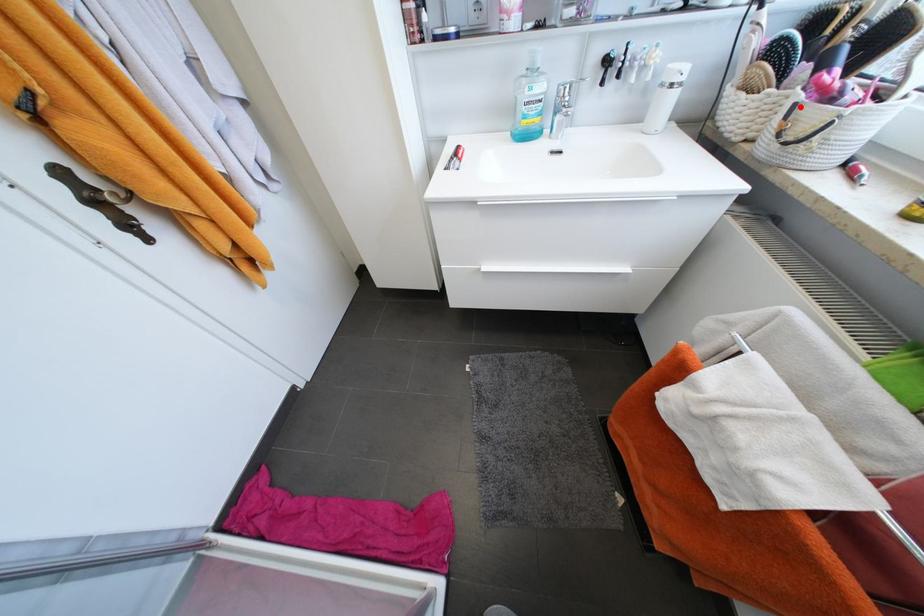
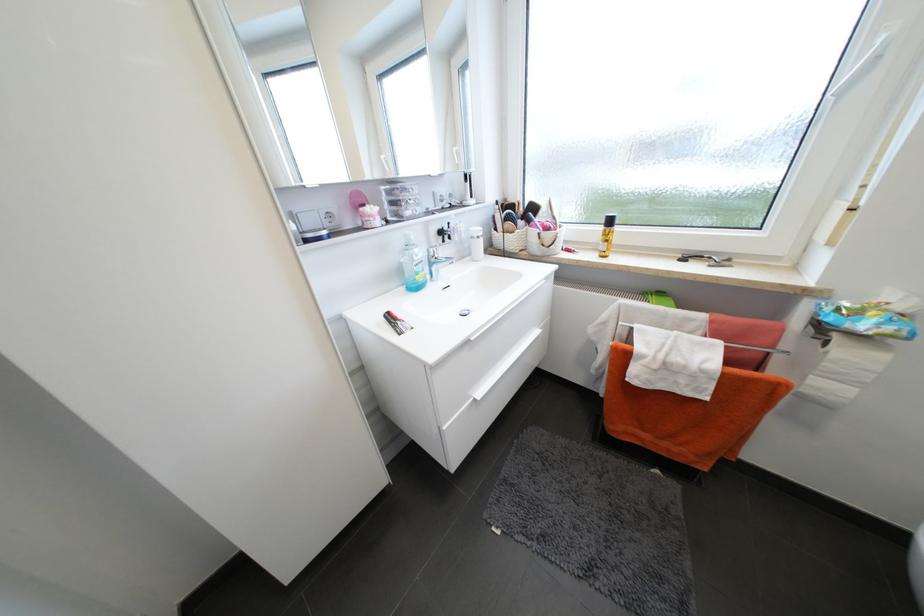
Question: I am providing you with two images of the same scene from different viewpoints. In image1, a red point is highlighted. Considering the same 3D point in image2, which of the following is correct?

Choices:
 (A) It is closer
 (B) It is farther

Answer: (A)